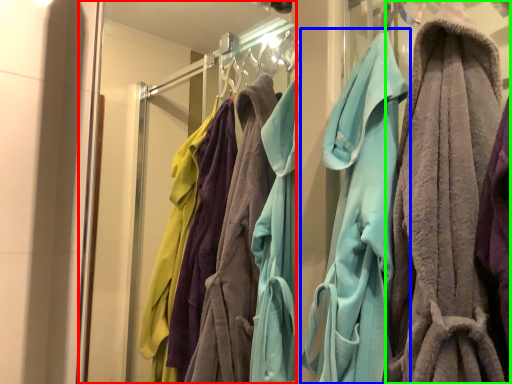
Question: Which object is the closest to the glass door (highlighted by a red box)? Choose among these: towel (highlighted by a blue box) or towel (highlighted by a green box).

Choices:
 (A) towel
 (B) towel

Answer: (A)